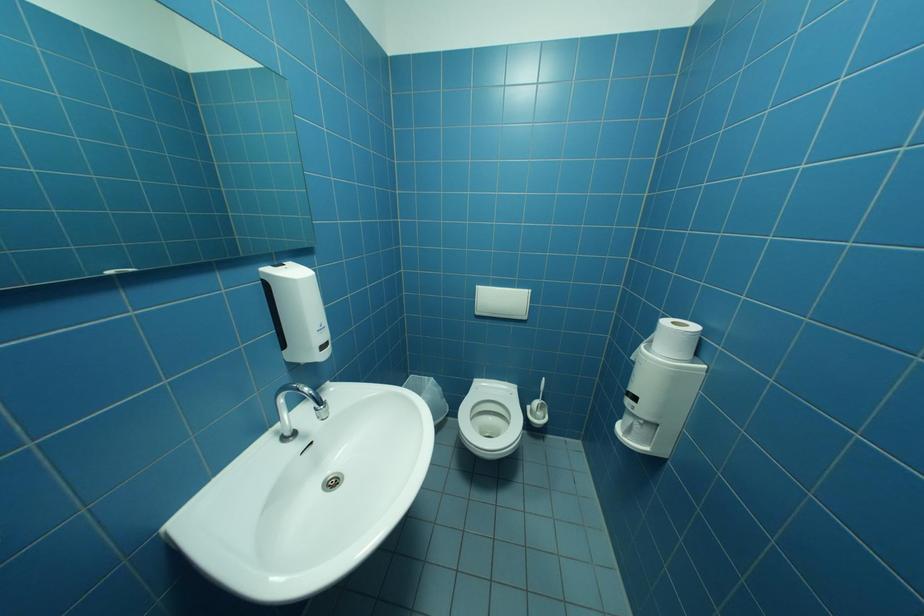
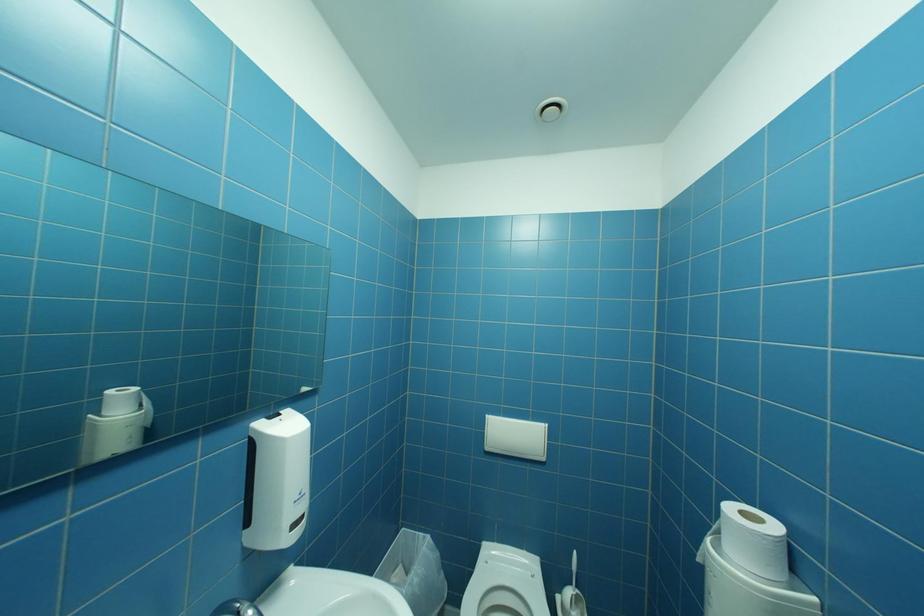
Question: Based on the continuous images, in which direction is the camera rotating? Reply with the corresponding letter.

Choices:
 (A) Left
 (B) Right
 (C) Up
 (D) Down

Answer: (C)